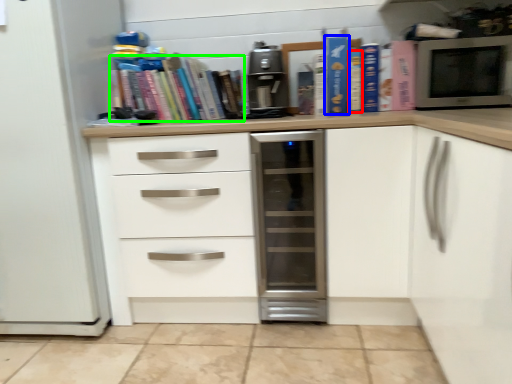
Question: Which object is positioned farthest from paperback book (highlighted by a red box)? Select from paperback book (highlighted by a blue box) and book (highlighted by a green box).

Choices:
 (A) paperback book
 (B) book

Answer: (B)